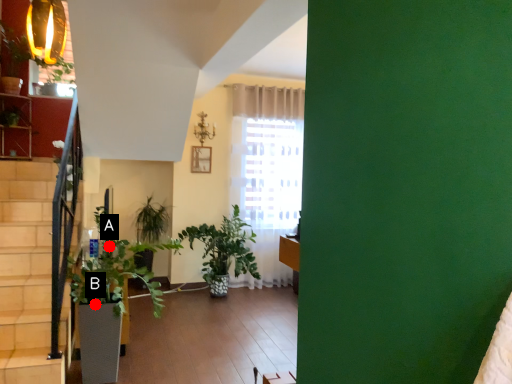
Question: Two points are circled on the image, labeled by A and B beside each circle. Which point is closer to the camera taking this photo?

Choices:
 (A) A is closer
 (B) B is closer

Answer: (B)